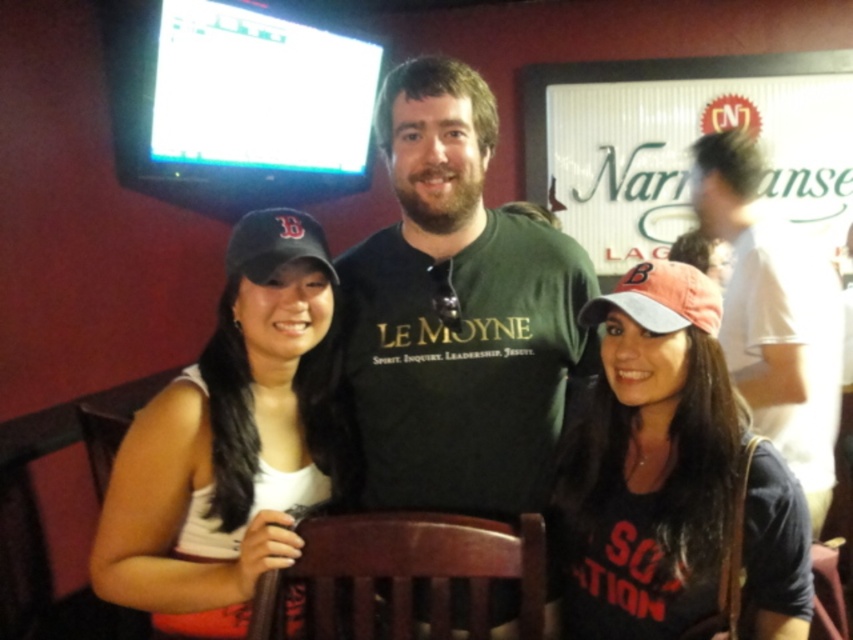
Question: Can you confirm if white cotton shirt at upper right is bigger than matte black cap at left?

Choices:
 (A) yes
 (B) no

Answer: (A)

Question: Is dark green t-shirt at center positioned behind matte black cap at left?

Choices:
 (A) no
 (B) yes

Answer: (B)

Question: Which object is positioned closest to the white cotton shirt at upper right?

Choices:
 (A) dark green t-shirt at center
 (B) pink fabric cap at center
 (C) white matte baseball cap at left
 (D) orange fabric baseball cap at lower right

Answer: (B)

Question: Is white cotton shirt at upper right to the left of orange fabric baseball cap at lower right from the viewer's perspective?

Choices:
 (A) no
 (B) yes

Answer: (A)

Question: Which object appears farthest from the camera in this image?

Choices:
 (A) orange fabric baseball cap at lower right
 (B) pink fabric cap at center

Answer: (A)

Question: Which of the following is the farthest from the observer?

Choices:
 (A) dark green t-shirt at center
 (B) pink fabric cap at center
 (C) white cotton shirt at upper right

Answer: (C)